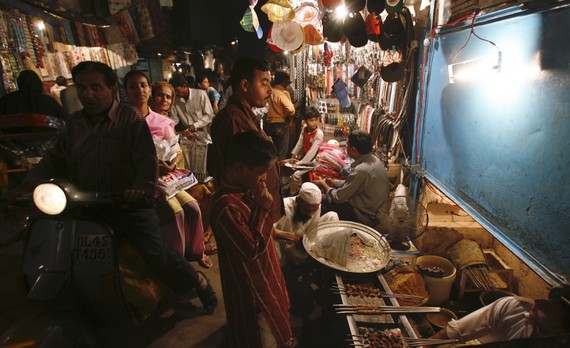
Locate an element on the screen. tray is located at coordinates (329, 249).